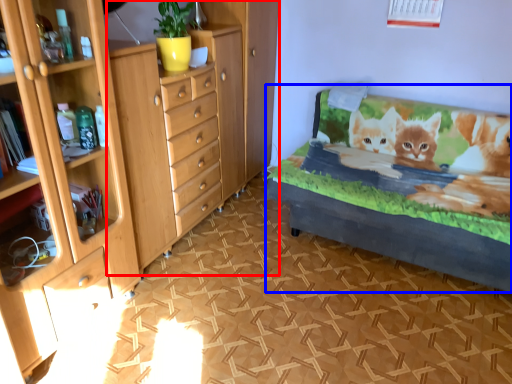
Question: Which point is closer to the camera, chest of drawers (highlighted by a red box) or bed frame (highlighted by a blue box)?

Choices:
 (A) chest of drawers
 (B) bed frame

Answer: (A)